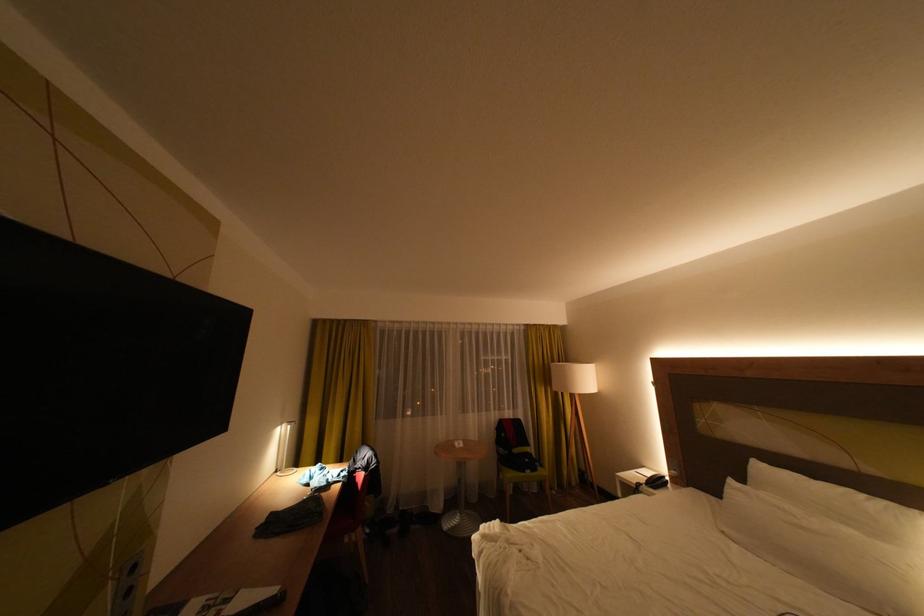
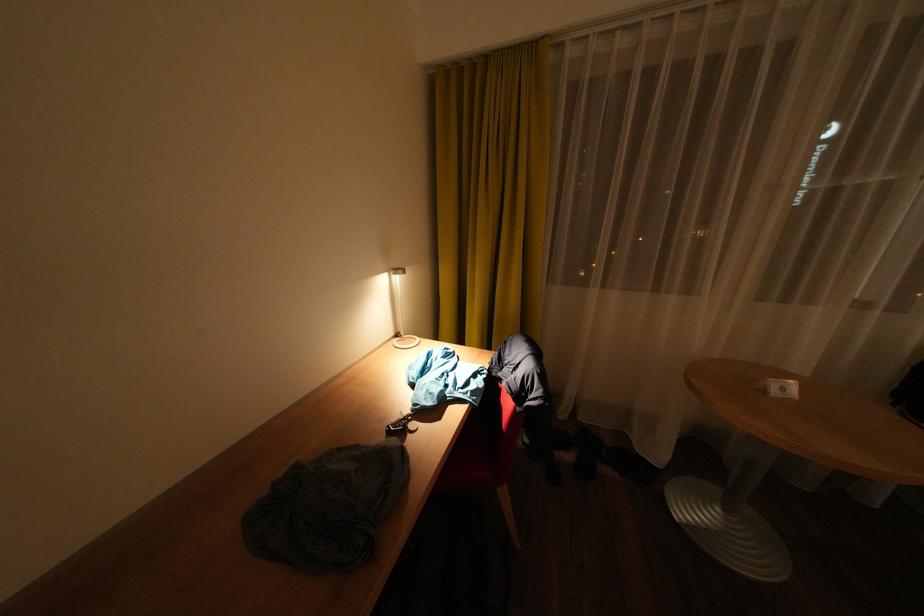
Where in the second image is the point corresponding to pixel 287 472 from the first image?

(407, 336)